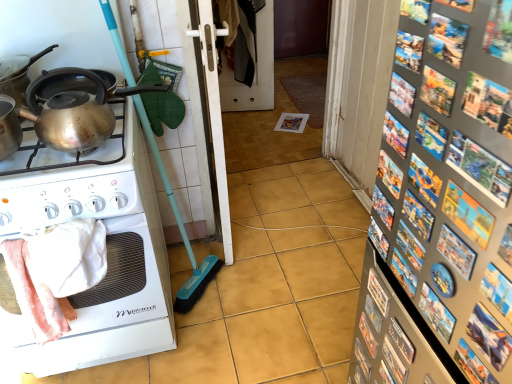
The image size is (512, 384). What are the coordinates of `unoccupied area in front of white plastic screen door at center, positioned as the second screen door in back-to-front order` in the screenshot? It's located at (248, 278).